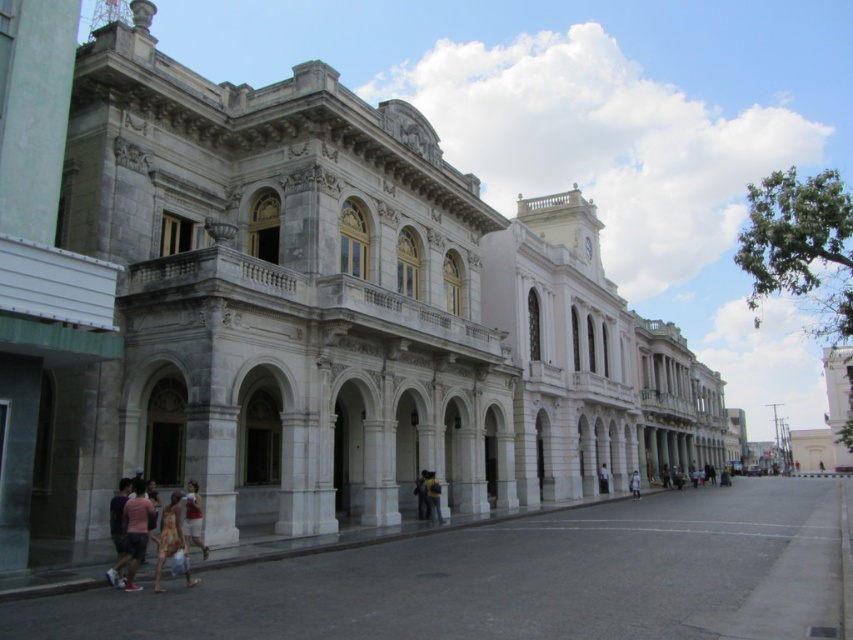
Can you confirm if gray concrete plaza at center is positioned below light blue denim jeans at center?

No.

Which is below, gray concrete plaza at center or light blue denim jeans at center?

Positioned lower is light blue denim jeans at center.

This screenshot has width=853, height=640. In order to click on gray concrete plaza at center in this screenshot , I will do `click(521, 579)`.

Measure the distance between matte white shirt at center and camera.

The distance of matte white shirt at center from camera is 46.65 meters.

Can you confirm if matte white shirt at center is shorter than light blue denim jeans at center?

Yes.

The height and width of the screenshot is (640, 853). Describe the element at coordinates (193, 516) in the screenshot. I see `matte white shirt at center` at that location.

Find the location of `matte white shirt at center`. matte white shirt at center is located at coordinates (193, 516).

Is gray concrete plaza at center below light pink cotton shirt at lower left?

Yes, gray concrete plaza at center is below light pink cotton shirt at lower left.

Does gray concrete plaza at center come behind light pink cotton shirt at lower left?

No, gray concrete plaza at center is closer to the viewer.

Which is in front, point (763, 595) or point (138, 499)?

Positioned in front is point (763, 595).

Locate an element on the screen. This screenshot has width=853, height=640. gray concrete plaza at center is located at coordinates (521, 579).